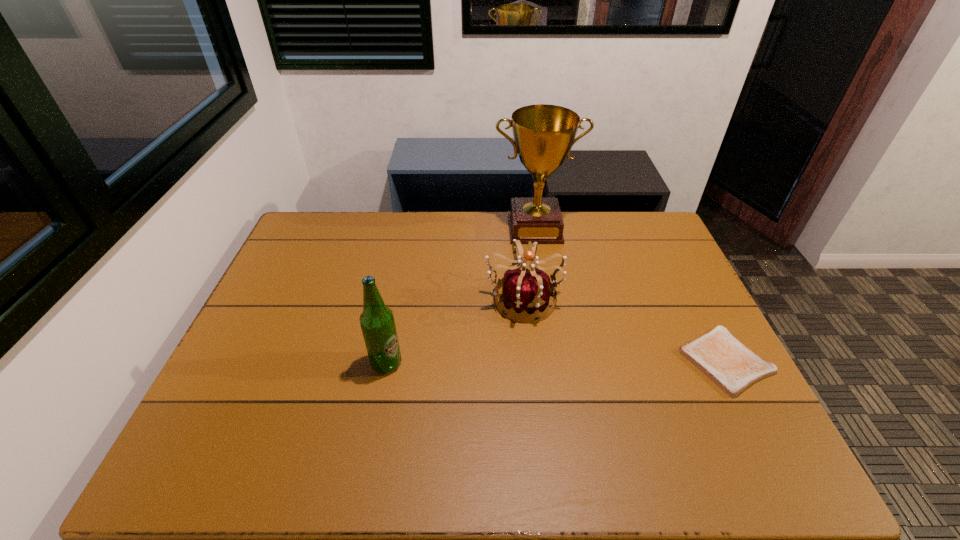
Where is `blank space located on the plaque of the farthest object`? blank space located on the plaque of the farthest object is located at coordinates (546, 307).

The image size is (960, 540). In order to click on free space located on the plaque of the farthest object in this screenshot , I will do `click(542, 279)`.

You are a GUI agent. You are given a task and a screenshot of the screen. Output one action in this format:
    pyautogui.click(x=<x>, y=<y>)
    Task: Click on the free spot located 0.310m on the plaque of the farthest object
    The image size is (960, 540).
    Given the screenshot: What is the action you would take?
    pyautogui.click(x=547, y=312)

Where is `free space located on the front-facing side of the third tallest object`? free space located on the front-facing side of the third tallest object is located at coordinates (552, 356).

The image size is (960, 540). Identify the location of vacant point located on the front-facing side of the third tallest object. (557, 365).

This screenshot has height=540, width=960. Identify the location of vacant space situated 0.110m on the front-facing side of the third tallest object. (552, 356).

Where is `object situated at the far edge`? Image resolution: width=960 pixels, height=540 pixels. object situated at the far edge is located at coordinates (544, 134).

Locate an element on the screen. Image resolution: width=960 pixels, height=540 pixels. object present at the near edge is located at coordinates (728, 363).

Where is `object present at the right edge`? object present at the right edge is located at coordinates (728, 363).

Find the location of a particular element. This screenshot has width=960, height=540. object situated at the near right corner is located at coordinates (x=728, y=363).